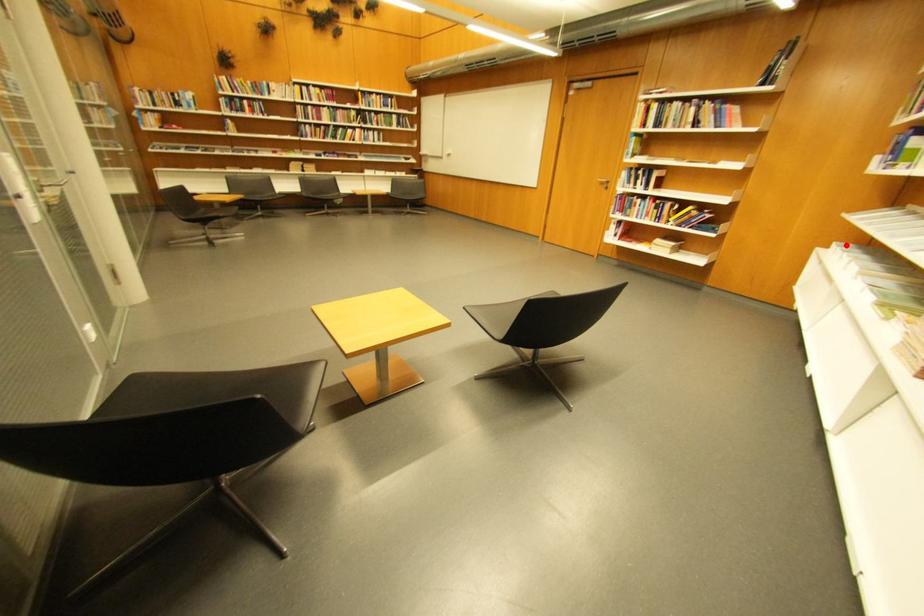
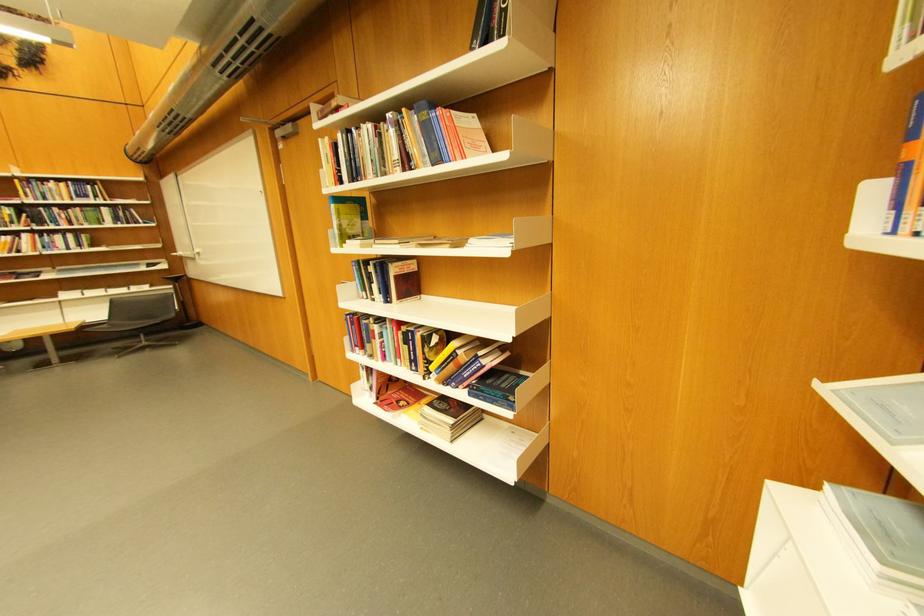
Locate, in the second image, the point that corresponds to the highlighted location in the first image.

(837, 485)